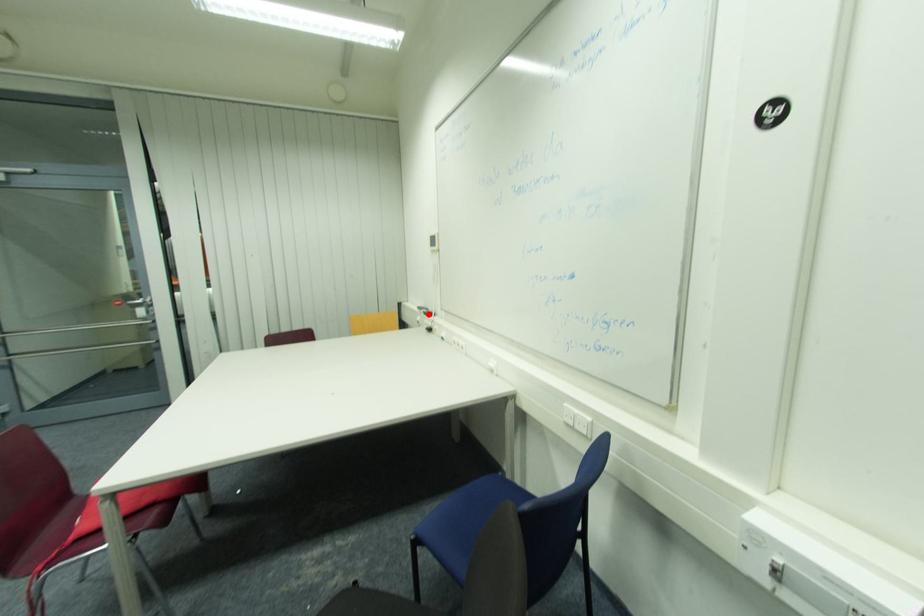
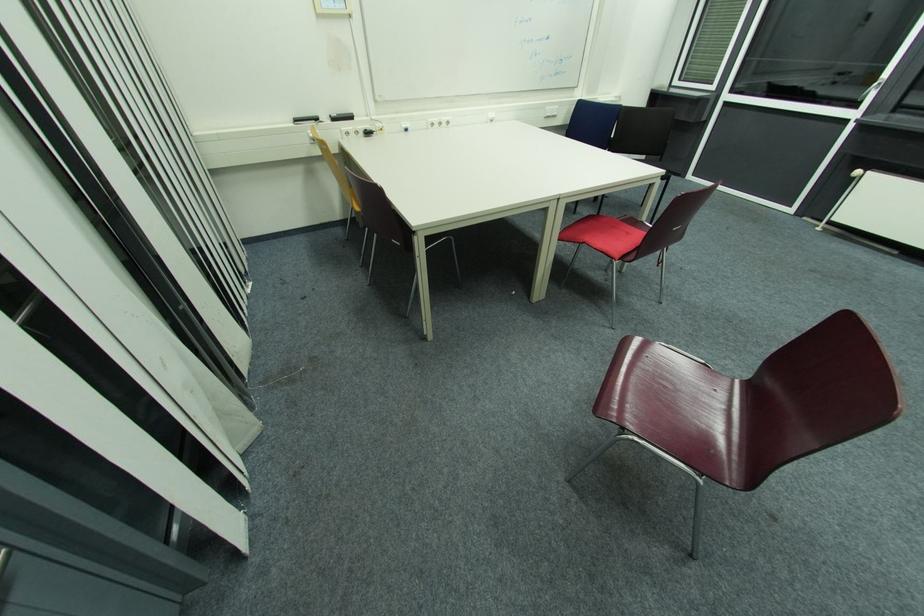
The point at the highlighted location is marked in the first image. Where is the corresponding point in the second image?

(337, 121)